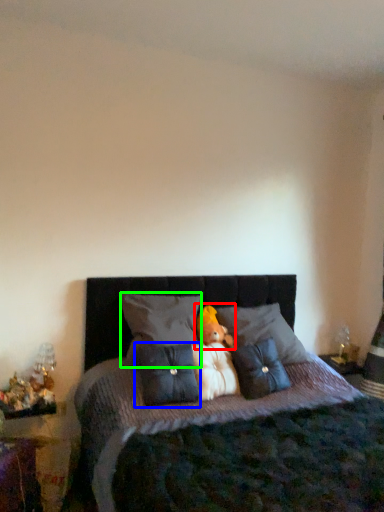
Question: Which object is positioned closest to animal (highlighted by a red box)? Select from pillow (highlighted by a blue box) and pillow (highlighted by a green box).

Choices:
 (A) pillow
 (B) pillow

Answer: (B)